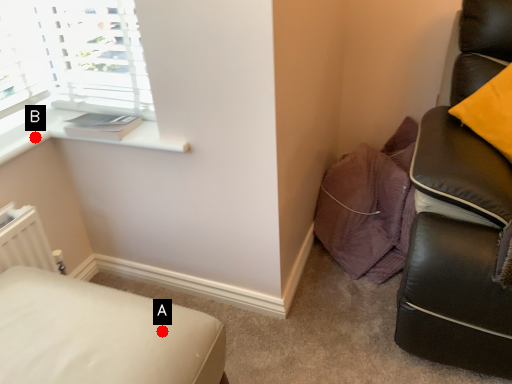
Question: Two points are circled on the image, labeled by A and B beside each circle. Which point is closer to the camera?

Choices:
 (A) A is closer
 (B) B is closer

Answer: (A)